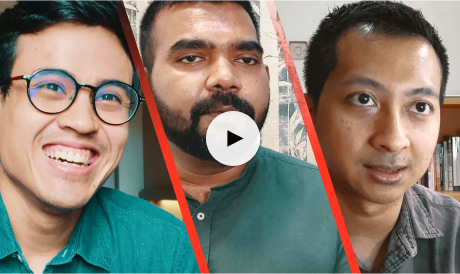
The width and height of the screenshot is (460, 274). I want to click on books, so click(x=452, y=155).